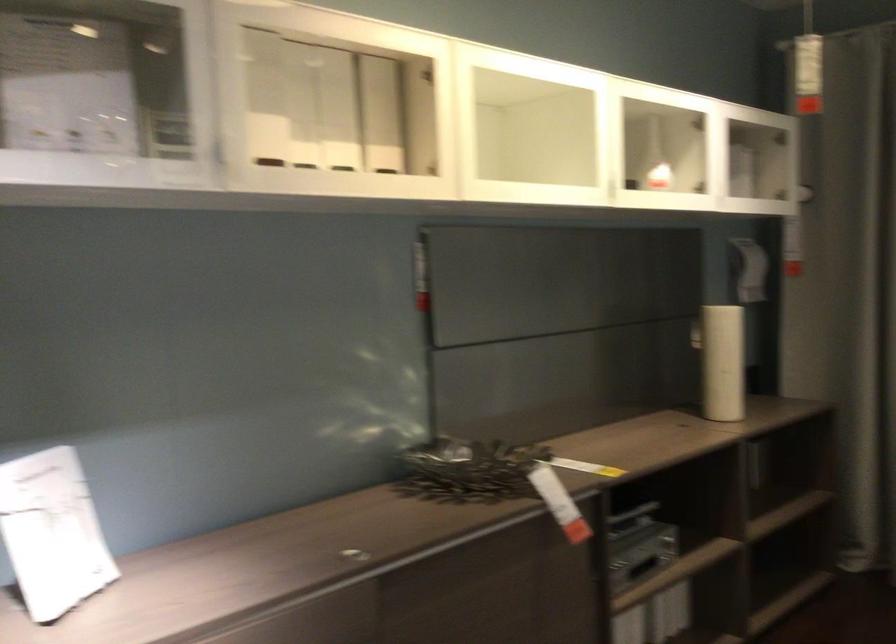
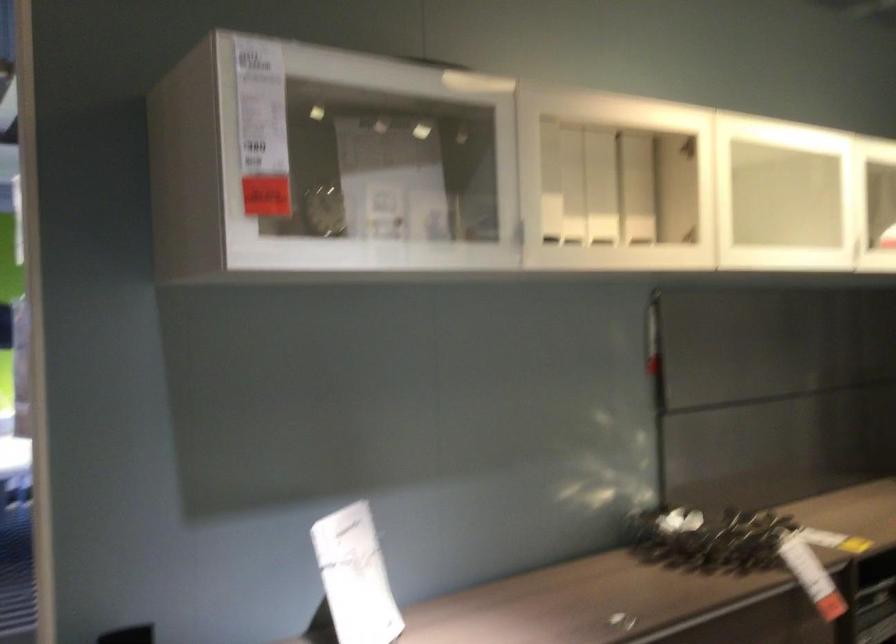
In the second image, find the point that corresponds to point (341, 111) in the first image.

(600, 187)